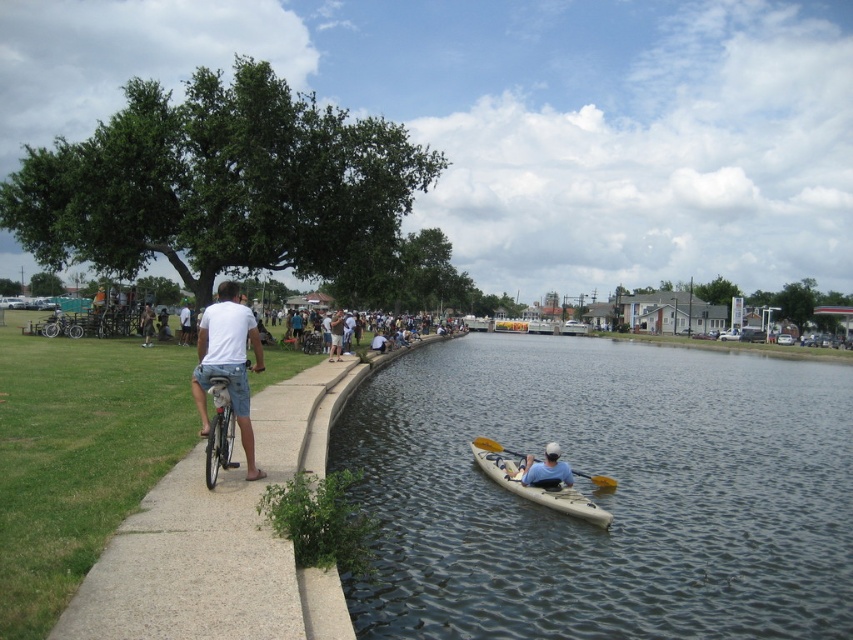
Looking at this image, can you confirm if clear water at center is positioned below yellow plastic paddle at lower center?

No.

Does clear water at center appear on the right side of yellow plastic paddle at lower center?

Yes, clear water at center is to the right of yellow plastic paddle at lower center.

What do you see at coordinates (604, 493) in the screenshot? I see `clear water at center` at bounding box center [604, 493].

Where is `clear water at center`? clear water at center is located at coordinates (604, 493).

Is point (294, 404) less distant than point (552, 465)?

No, it is not.

Can you confirm if gray concrete sidewalk at left is bigger than blue fabric kayak at lower center?

Yes.

Find the location of a particular element. gray concrete sidewalk at left is located at coordinates (223, 538).

Can you confirm if blue fabric kayak at lower center is bigger than yellow plastic paddle at lower center?

Yes.

Between point (552, 483) and point (485, 445), which one is positioned in front?

Point (552, 483)

Is point (572, 480) farther from viewer compared to point (482, 444)?

No, it is not.

What are the coordinates of `blue fabric kayak at lower center` in the screenshot? It's located at (546, 468).